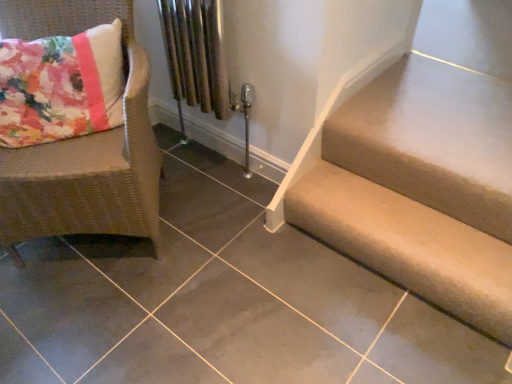
Question: In terms of height, does woven rattan chair at left look taller or shorter compared to beige fabric stairs at lower right?

Choices:
 (A) tall
 (B) short

Answer: (A)

Question: In terms of width, does woven rattan chair at left look wider or thinner when compared to beige fabric stairs at lower right?

Choices:
 (A) thin
 (B) wide

Answer: (B)

Question: Is point (90, 196) positioned closer to the camera than point (446, 162)?

Choices:
 (A) farther
 (B) closer

Answer: (B)

Question: Is beige fabric stairs at lower right taller or shorter than woven rattan chair at left?

Choices:
 (A) short
 (B) tall

Answer: (A)

Question: Does point (467, 319) appear closer or farther from the camera than point (123, 49)?

Choices:
 (A) closer
 (B) farther

Answer: (A)

Question: From the image's perspective, relative to woven rattan chair at left, is beige fabric stairs at lower right above or below?

Choices:
 (A) below
 (B) above

Answer: (A)

Question: Based on their sizes in the image, would you say beige fabric stairs at lower right is bigger or smaller than woven rattan chair at left?

Choices:
 (A) big
 (B) small

Answer: (B)